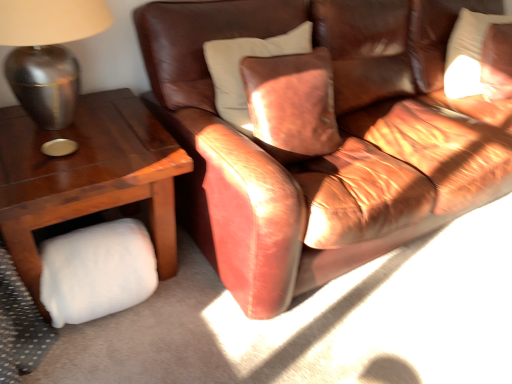
This screenshot has width=512, height=384. What are the coordinates of `free point in front of white fluffy pillow at lower left` in the screenshot? It's located at (97, 357).